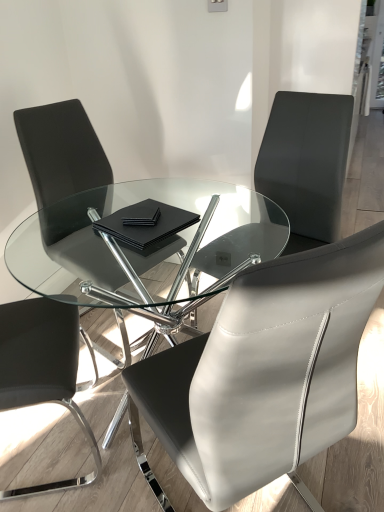
Question: From a real-world perspective, is black leather chair at left, the 1th chair positioned from the left, on top of transparent glass table at center?

Choices:
 (A) yes
 (B) no

Answer: (A)

Question: Can you confirm if black leather chair at left, the fourth chair positioned from the right, is shorter than transparent glass table at center?

Choices:
 (A) yes
 (B) no

Answer: (B)

Question: From the image's perspective, is black leather chair at left, the fourth chair positioned from the right, under transparent glass table at center?

Choices:
 (A) yes
 (B) no

Answer: (A)

Question: Does black leather chair at left, the fourth chair positioned from the right, have a greater height compared to transparent glass table at center?

Choices:
 (A) yes
 (B) no

Answer: (A)

Question: Can you confirm if black leather chair at left, the 1th chair positioned from the left, is positioned to the right of transparent glass table at center?

Choices:
 (A) no
 (B) yes

Answer: (A)

Question: Does black leather chair at left, the 1th chair positioned from the left, appear on the left side of transparent glass table at center?

Choices:
 (A) yes
 (B) no

Answer: (A)

Question: Can you confirm if matte black chair at left, arranged as the 3th chair when viewed from the right, is shorter than black leather chair at upper right, the fourth chair viewed from the left?

Choices:
 (A) yes
 (B) no

Answer: (B)

Question: Considering the relative sizes of matte black chair at left, which ranks as the second chair in left-to-right order, and black leather chair at upper right, the fourth chair viewed from the left, in the image provided, is matte black chair at left, which ranks as the second chair in left-to-right order, smaller than black leather chair at upper right, the fourth chair viewed from the left,?

Choices:
 (A) yes
 (B) no

Answer: (B)

Question: From the image's perspective, does matte black chair at left, arranged as the 3th chair when viewed from the right, appear lower than black leather chair at upper right, the fourth chair viewed from the left?

Choices:
 (A) no
 (B) yes

Answer: (B)

Question: Is matte black chair at left, which ranks as the second chair in left-to-right order, in contact with black leather chair at upper right, marked as the 1th chair in a right-to-left arrangement?

Choices:
 (A) yes
 (B) no

Answer: (B)

Question: Is matte black chair at left, arranged as the 3th chair when viewed from the right, positioned beyond the bounds of black leather chair at upper right, marked as the 1th chair in a right-to-left arrangement?

Choices:
 (A) yes
 (B) no

Answer: (A)

Question: From the image's perspective, does matte black chair at left, which ranks as the second chair in left-to-right order, appear higher than black leather chair at upper right, the fourth chair viewed from the left?

Choices:
 (A) no
 (B) yes

Answer: (A)

Question: From the image's perspective, is black leather chair at left, the fourth chair positioned from the right, below black leather chair at upper right, the fourth chair viewed from the left?

Choices:
 (A) no
 (B) yes

Answer: (B)